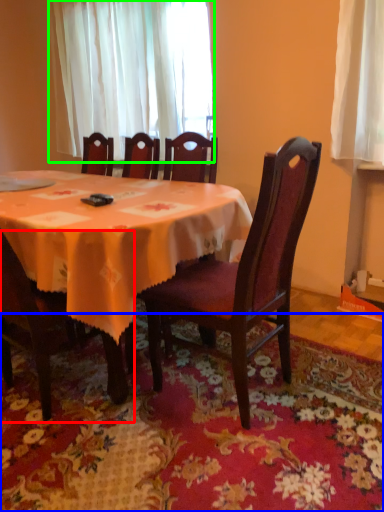
Question: Which is nearer to the chair (highlighted by a red box)? mat (highlighted by a blue box) or curtain (highlighted by a green box).

Choices:
 (A) mat
 (B) curtain

Answer: (A)